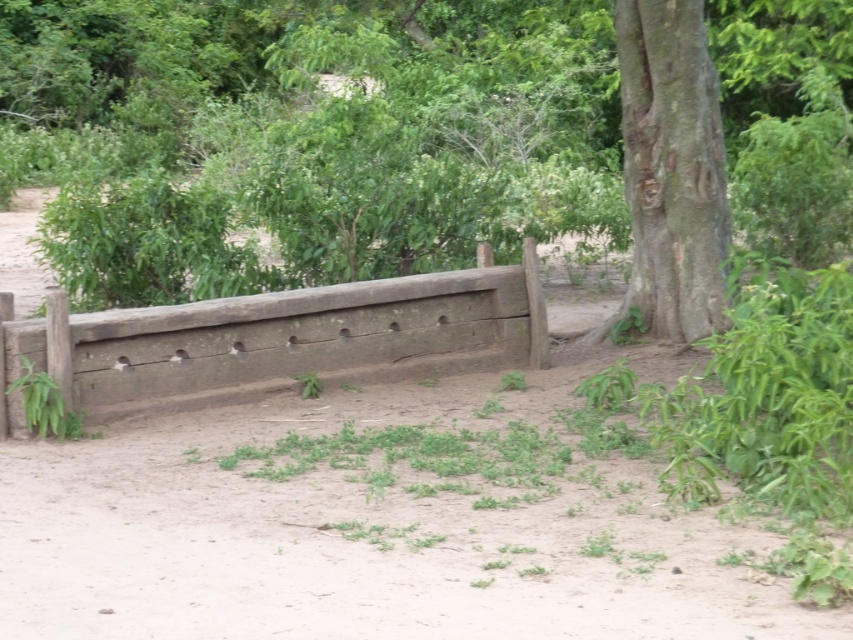
You are standing in the middle of the image and see the point at coordinates [287,339]. Based on the scene description, what is the location of this point relative to the wooden structure?

The point at coordinates [287,339] is located on the weathered wood fence at center, which is the wooden structure described in the scene.

You are standing in the middle of the scene and want to walk towards the brown wood tree at center. Which direction should you walk relative to the weathered wood fence at center?

The brown wood tree at center is to the right of the weathered wood fence at center, so you should walk to the right relative to the weathered wood fence at center to reach the brown wood tree at center.